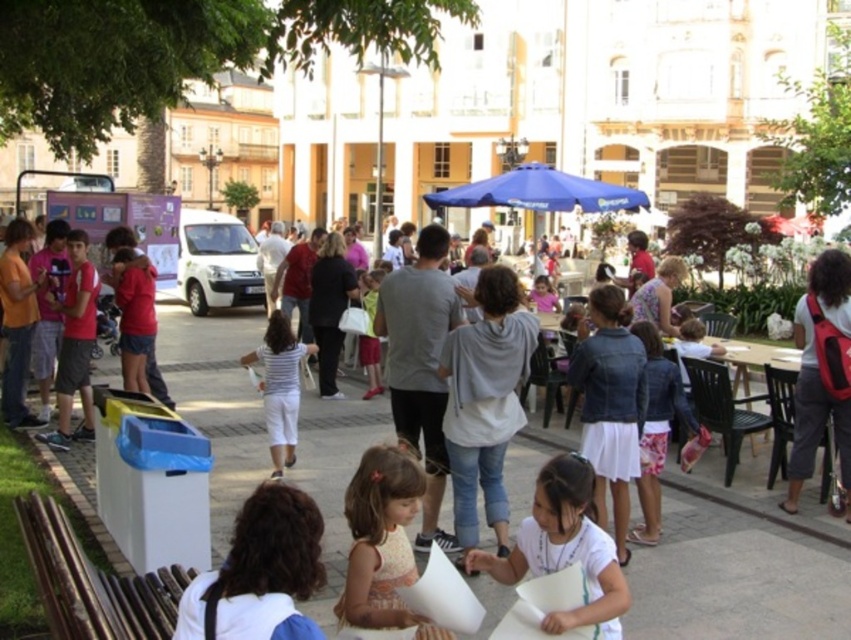
You are standing at the location of the camera in the scene. There is a light brown fabric dress at center that you need to deliver a package to. Can you walk directly to it without needing to go around any obstacles?

The light brown fabric dress at center and the camera are 32.61 meters apart from each other, so you can walk directly to it without needing to go around any obstacles since there is no mention of obstacles between them in the scene description.

You are a visitor in the park and want to find a spot under the blue fabric umbrella at center. You see the brown wooden bench at lower left. Which direction should you move relative to the bench?

To reach the blue fabric umbrella at center from the brown wooden bench at lower left, you should move to the right since the bench is to the left of the umbrella.